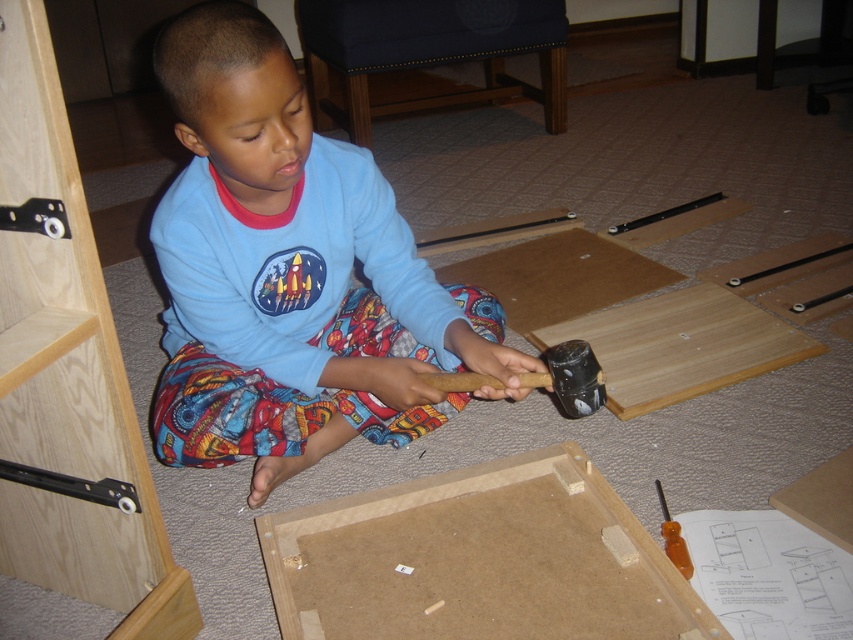
The child is holding the black rubber hammer at center and wearing the blue cotton shirt at center. Which item is wider?

The blue cotton shirt at center is wider than the black rubber hammer at center.

The child is holding a tool and wearing a shirt. Based on the scene, which object is positioned to the left of the other between the blue cotton shirt at center and the black rubber hammer at center?

The blue cotton shirt at center is to the left of the black rubber hammer at center.